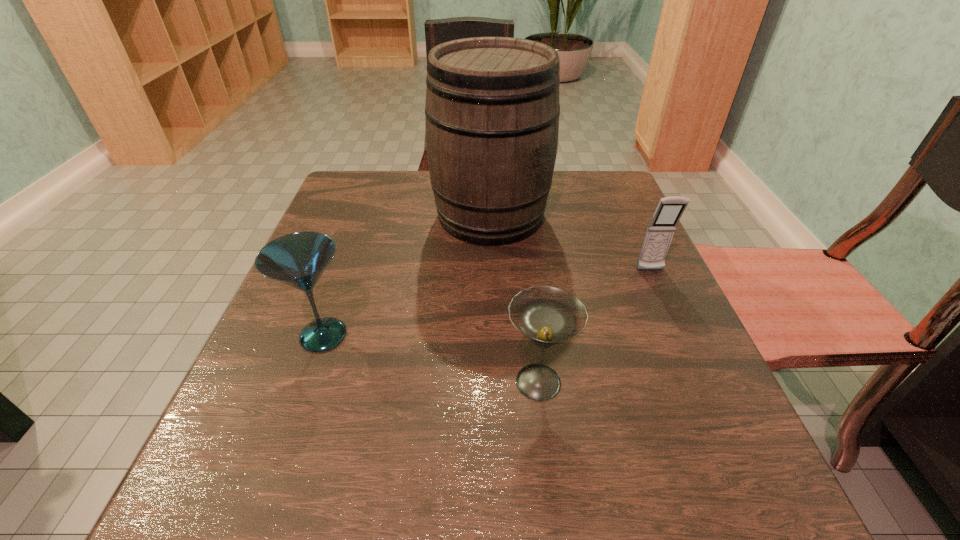
At what (x,y) coordinates should I click in order to perform the action: click on object that can be found as the third closest to the second farthest object. Please return your answer as a coordinate pair (x, y). Image resolution: width=960 pixels, height=540 pixels. Looking at the image, I should click on (298, 259).

Identify the location of free space that satisfies the following two spatial constraints: 1. on the back side of the farthest object; 2. on the right side of the left martini. The width and height of the screenshot is (960, 540). (366, 215).

You are a GUI agent. You are given a task and a screenshot of the screen. Output one action in this format:
    pyautogui.click(x=<x>, y=<y>)
    Task: Click on the free space that satisfies the following two spatial constraints: 1. on the front side of the tallest object; 2. on the right side of the right martini
    The image size is (960, 540).
    Given the screenshot: What is the action you would take?
    pyautogui.click(x=495, y=382)